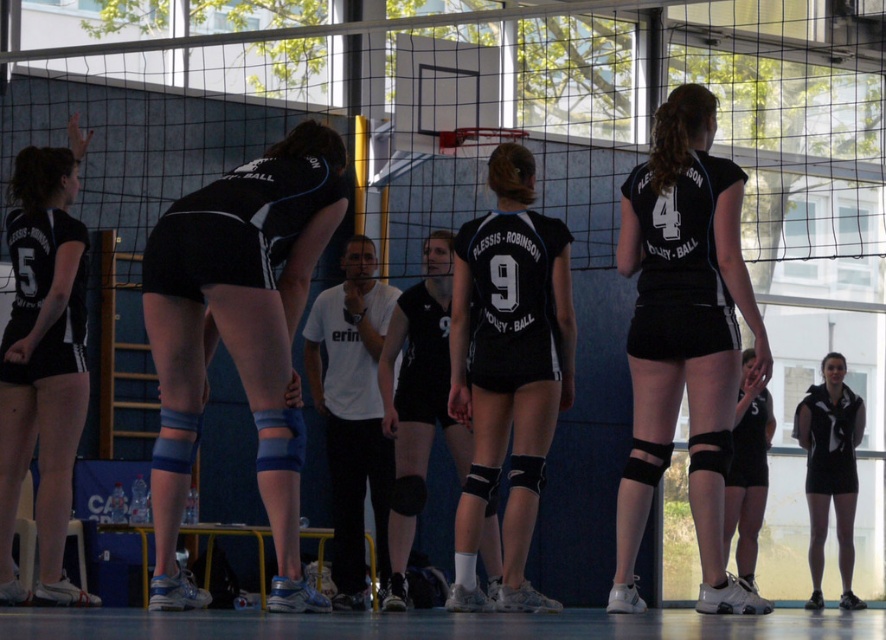
Question: Based on their relative distances, which object is nearer to the matte black shorts at left?

Choices:
 (A) black matte knee pads at lower right
 (B) matte black volleyball uniform at center

Answer: (B)

Question: Is black matte volleyball at center positioned at the back of matte black shorts at lower right?

Choices:
 (A) no
 (B) yes

Answer: (A)

Question: Considering the relative positions of matte black shorts at left and black matte volleyball at center in the image provided, where is matte black shorts at left located with respect to black matte volleyball at center?

Choices:
 (A) left
 (B) right

Answer: (A)

Question: Among these points, which one is nearest to the camera?

Choices:
 (A) (821, 499)
 (B) (43, 310)
 (C) (177, 212)
 (D) (488, 260)

Answer: (C)

Question: Among these objects, which one is nearest to the camera?

Choices:
 (A) black matte knee pads at lower right
 (B) black matte volleyball at center
 (C) matte black volleyball uniform at center
 (D) matte black shorts at center

Answer: (D)

Question: Does matte black shorts at center have a smaller size compared to black matte volleyball at center?

Choices:
 (A) yes
 (B) no

Answer: (B)